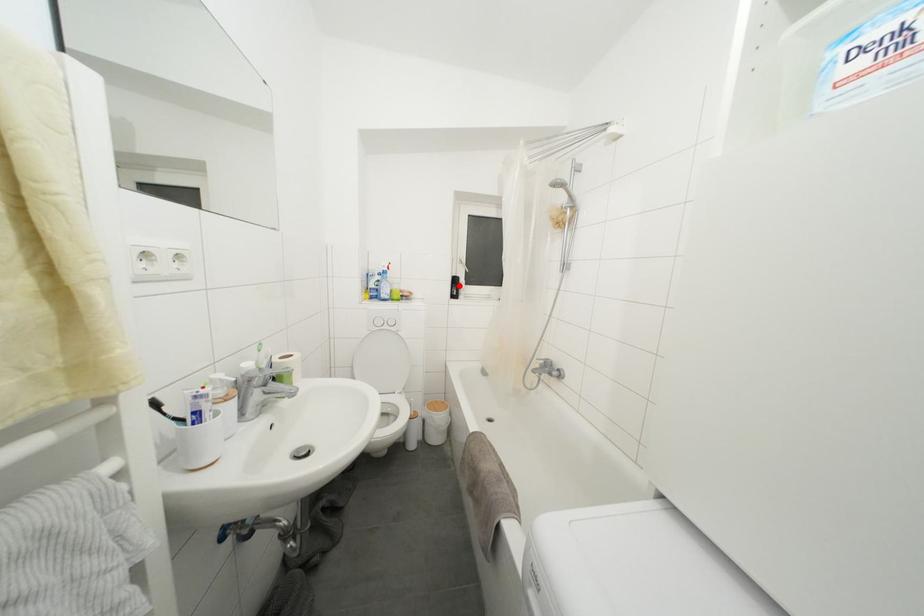
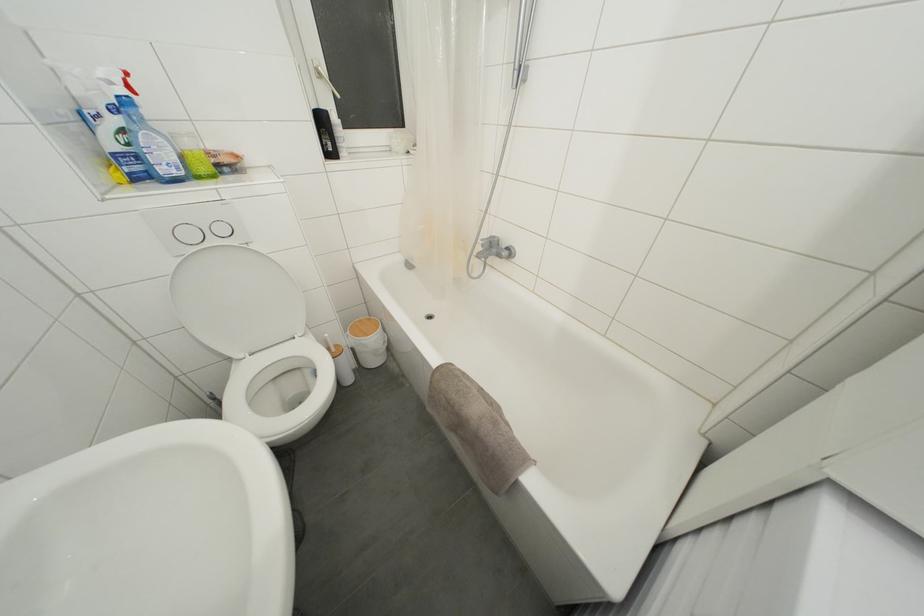
Find the pixel in the second image that matches the highlighted location in the first image.

(325, 126)